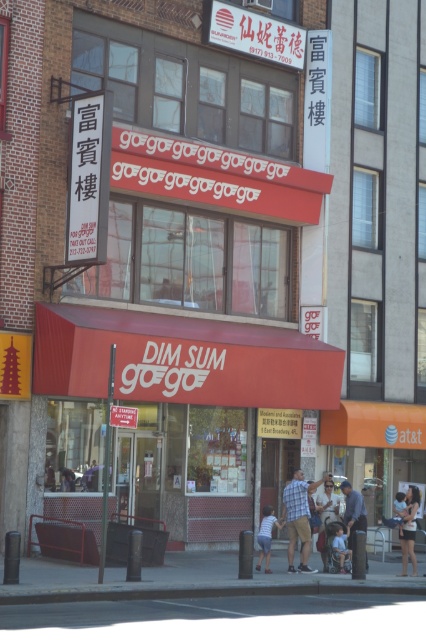
Question: Is denim shorts at lower center wider than light blue fabric shirt at center?

Choices:
 (A) yes
 (B) no

Answer: (A)

Question: Observing the image, what is the correct spatial positioning of matte black shorts at lower right in reference to light blue denim jeans at lower right?

Choices:
 (A) above
 (B) below

Answer: (B)

Question: Does light blue denim jeans at lower right appear under denim shorts at lower center?

Choices:
 (A) yes
 (B) no

Answer: (B)

Question: Among these points, which one is nearest to the camera?

Choices:
 (A) (327, 516)
 (B) (412, 512)
 (C) (342, 536)
 (D) (268, 515)

Answer: (D)

Question: Estimate the real-world distances between objects in this image. Which object is farther from the blue denim jeans at lower center?

Choices:
 (A) light blue fabric shirt at center
 (B) plaid shirt at center
 (C) matte black shorts at lower right
 (D) denim shorts at lower center

Answer: (D)

Question: Which object appears closest to the camera in this image?

Choices:
 (A) light blue fabric shirt at center
 (B) plaid shirt at center
 (C) matte black shorts at lower right

Answer: (B)